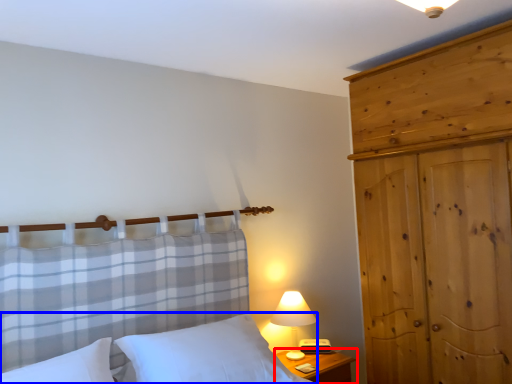
Question: Among these objects, which one is farthest to the camera, nightstand (highlighted by a red box) or bed (highlighted by a blue box)?

Choices:
 (A) nightstand
 (B) bed

Answer: (A)